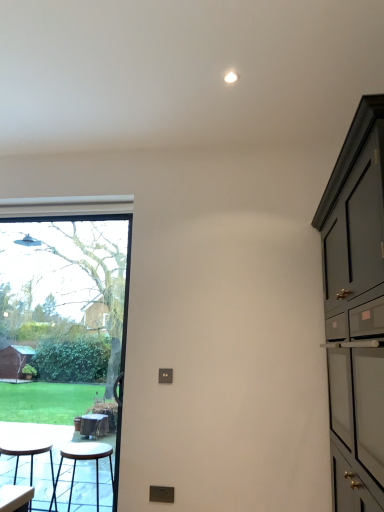
Question: Considering the relative sizes of metallic stool at lower left, which is the 1th stool from right to left, and transparent glass window at left in the image provided, is metallic stool at lower left, which is the 1th stool from right to left, shorter than transparent glass window at left?

Choices:
 (A) no
 (B) yes

Answer: (B)

Question: Can you confirm if metallic stool at lower left, marked as the 2th stool in a left-to-right arrangement, is wider than transparent glass window at left?

Choices:
 (A) no
 (B) yes

Answer: (B)

Question: Is metallic stool at lower left, marked as the 2th stool in a left-to-right arrangement, bigger than transparent glass window at left?

Choices:
 (A) yes
 (B) no

Answer: (B)

Question: From a real-world perspective, is metallic stool at lower left, marked as the 2th stool in a left-to-right arrangement, on transparent glass window at left?

Choices:
 (A) yes
 (B) no

Answer: (B)

Question: Would you say transparent glass window at left is part of metallic stool at lower left, which is the 1th stool from right to left,'s contents?

Choices:
 (A) yes
 (B) no

Answer: (B)

Question: Based on their positions, is transparent glass window at left located to the left or right of metallic stool at lower left, marked as the 2th stool in a left-to-right arrangement?

Choices:
 (A) left
 (B) right

Answer: (A)

Question: From the image's perspective, relative to metallic stool at lower left, which is the 1th stool from right to left, is transparent glass window at left above or below?

Choices:
 (A) below
 (B) above

Answer: (B)

Question: Is transparent glass window at left wider or thinner than metallic stool at lower left, marked as the 2th stool in a left-to-right arrangement?

Choices:
 (A) wide
 (B) thin

Answer: (B)

Question: Do you think transparent glass window at left is within metallic stool at lower left, which is the 1th stool from right to left, or outside of it?

Choices:
 (A) inside
 (B) outside

Answer: (B)

Question: In terms of size, does matte black stool at lower left, which is the second stool from right to left, appear bigger or smaller than metallic stool at lower left, marked as the 2th stool in a left-to-right arrangement?

Choices:
 (A) big
 (B) small

Answer: (A)

Question: From a real-world perspective, is matte black stool at lower left, positioned as the 1th stool in left-to-right order, positioned above or below metallic stool at lower left, marked as the 2th stool in a left-to-right arrangement?

Choices:
 (A) above
 (B) below

Answer: (B)

Question: Considering the positions of matte black stool at lower left, positioned as the 1th stool in left-to-right order, and metallic stool at lower left, which is the 1th stool from right to left, in the image, is matte black stool at lower left, positioned as the 1th stool in left-to-right order, wider or thinner than metallic stool at lower left, which is the 1th stool from right to left,?

Choices:
 (A) wide
 (B) thin

Answer: (B)

Question: In terms of height, does matte black stool at lower left, which is the second stool from right to left, look taller or shorter compared to metallic stool at lower left, which is the 1th stool from right to left?

Choices:
 (A) short
 (B) tall

Answer: (B)

Question: Is transparent glass window at left in front of or behind matte dark green cabinet at right in the image?

Choices:
 (A) front
 (B) behind

Answer: (B)

Question: Based on their sizes in the image, would you say transparent glass window at left is bigger or smaller than matte dark green cabinet at right?

Choices:
 (A) small
 (B) big

Answer: (A)